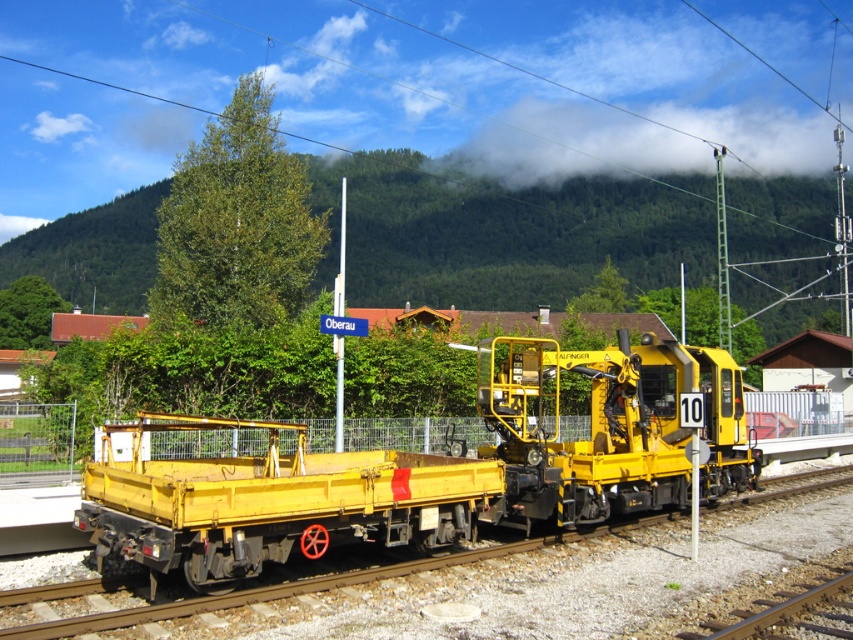
Which is more to the left, yellow matte train car at center or matte yellow flatbed at center?

From the viewer's perspective, matte yellow flatbed at center appears more on the left side.

Can you confirm if yellow matte train car at center is wider than matte yellow flatbed at center?

Yes, yellow matte train car at center is wider than matte yellow flatbed at center.

Is point (183, 570) farther from camera compared to point (398, 515)?

No, (183, 570) is closer to viewer.

Image resolution: width=853 pixels, height=640 pixels. I want to click on yellow matte train car at center, so click(x=426, y=468).

In the scene shown: Who is taller, yellow matte train car at center or green forested mountain at upper center?

With more height is green forested mountain at upper center.

Can you confirm if yellow matte train car at center is positioned to the left of green forested mountain at upper center?

In fact, yellow matte train car at center is to the right of green forested mountain at upper center.

This screenshot has width=853, height=640. Find the location of `yellow matte train car at center`. yellow matte train car at center is located at coordinates (426, 468).

The height and width of the screenshot is (640, 853). I want to click on yellow matte train car at center, so click(x=426, y=468).

Does point (670, 381) come closer to viewer compared to point (714, 595)?

No, (670, 381) is further to viewer.

Is point (618, 406) farther from camera compared to point (471, 586)?

That is True.

The width and height of the screenshot is (853, 640). In order to click on yellow matte train car at center in this screenshot , I will do `click(426, 468)`.